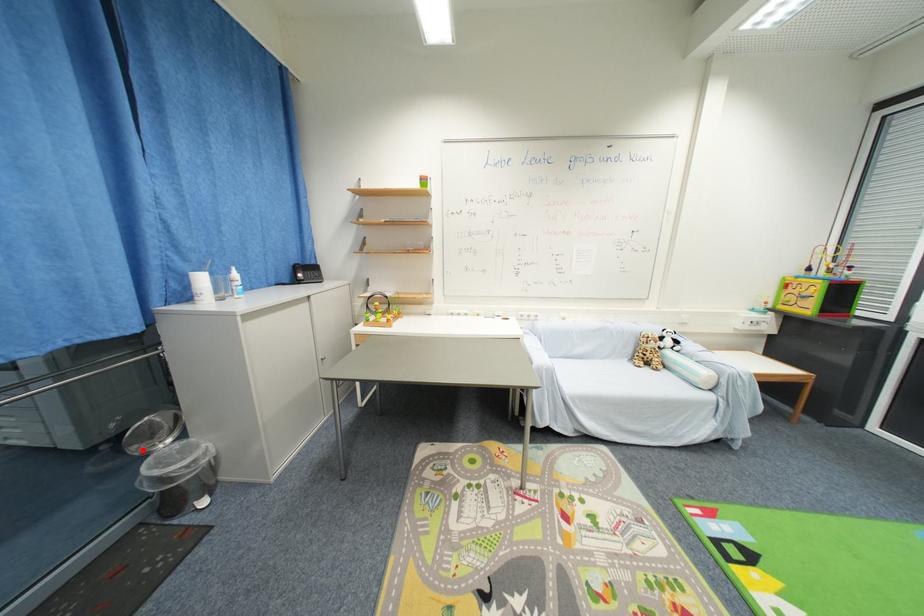
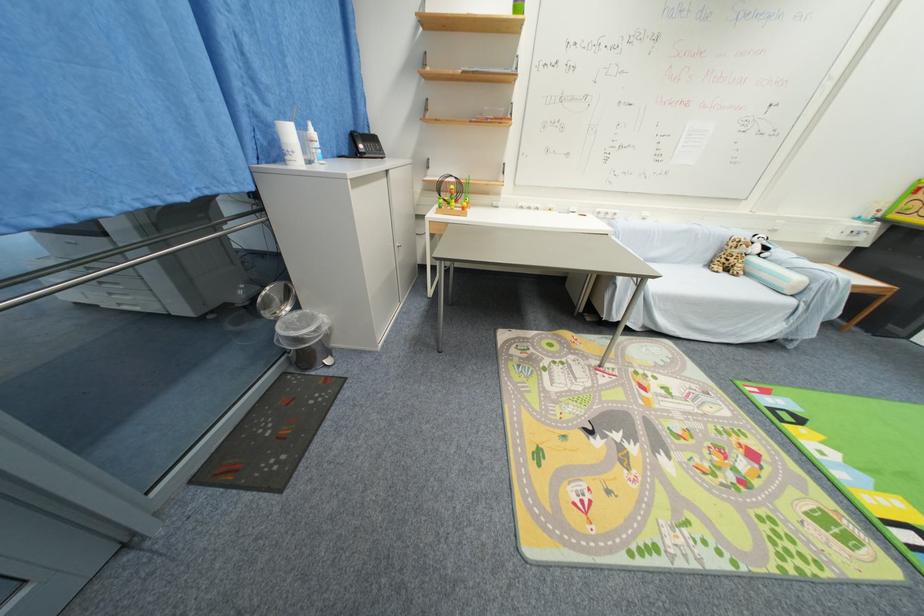
Locate, in the second image, the point that corresponds to the highlighted location in the first image.

(271, 315)